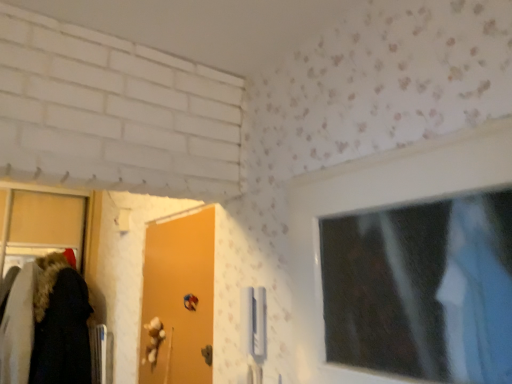
Question: Is orange matte door at center in front of or behind metallic blue door handle at lower center in the image?

Choices:
 (A) behind
 (B) front

Answer: (B)

Question: From the image's perspective, relative to metallic blue door handle at lower center, is orange matte door at center above or below?

Choices:
 (A) above
 (B) below

Answer: (A)

Question: Considering the positions of orange matte door at center and metallic blue door handle at lower center in the image, is orange matte door at center wider or thinner than metallic blue door handle at lower center?

Choices:
 (A) wide
 (B) thin

Answer: (A)

Question: Considering the positions of point (207, 347) and point (150, 233), is point (207, 347) closer or farther from the camera than point (150, 233)?

Choices:
 (A) farther
 (B) closer

Answer: (B)

Question: From a real-world perspective, is metallic blue door handle at lower center above or below orange matte door at center?

Choices:
 (A) above
 (B) below

Answer: (B)

Question: Considering the positions of metallic blue door handle at lower center and orange matte door at center in the image, is metallic blue door handle at lower center wider or thinner than orange matte door at center?

Choices:
 (A) wide
 (B) thin

Answer: (B)

Question: Considering the positions of metallic blue door handle at lower center and orange matte door at center in the image, is metallic blue door handle at lower center taller or shorter than orange matte door at center?

Choices:
 (A) tall
 (B) short

Answer: (B)